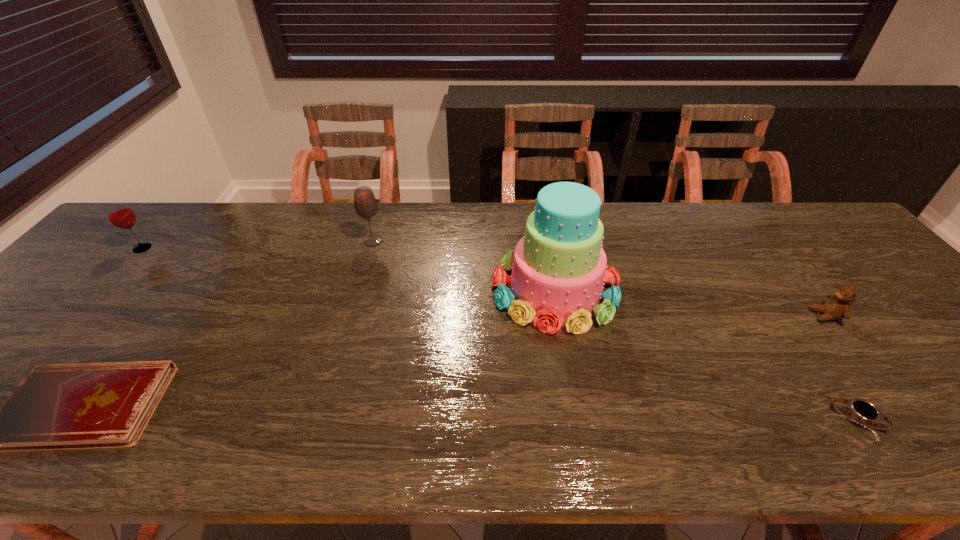
In order to click on free region at the left edge of the desktop in this screenshot , I will do point(70,313).

Find the location of a particular element. This screenshot has height=540, width=960. free region at the right edge of the desktop is located at coordinates (854, 254).

Find the location of a particular element. The width and height of the screenshot is (960, 540). free point between the rightmost object and the left glass is located at coordinates (484, 282).

Find the location of a particular element. The image size is (960, 540). unoccupied position between the left glass and the right glass is located at coordinates (258, 245).

Image resolution: width=960 pixels, height=540 pixels. Identify the location of empty location between the third object from left to right and the left glass. (258, 245).

This screenshot has width=960, height=540. I want to click on vacant area that lies between the left glass and the right glass, so click(258, 245).

Find the location of a particular element. blank region between the left glass and the fourth object from left to right is located at coordinates (348, 268).

The image size is (960, 540). Identify the location of empty location between the left glass and the cake. (348, 268).

Identify the location of object that is the closest to the third object from left to right. (559, 267).

Locate an element on the screen. This screenshot has width=960, height=540. object that is the second closest to the right glass is located at coordinates (87, 405).